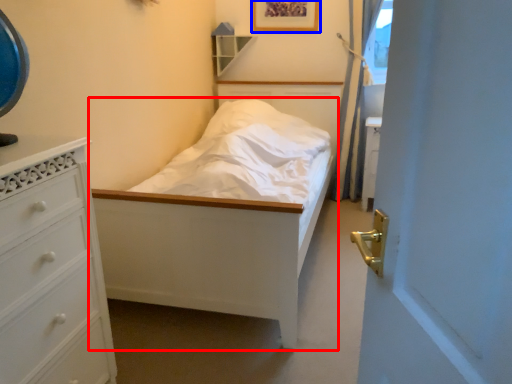
Question: Which of the following is the closest to the observer, bed (highlighted by a red box) or picture frame (highlighted by a blue box)?

Choices:
 (A) bed
 (B) picture frame

Answer: (A)